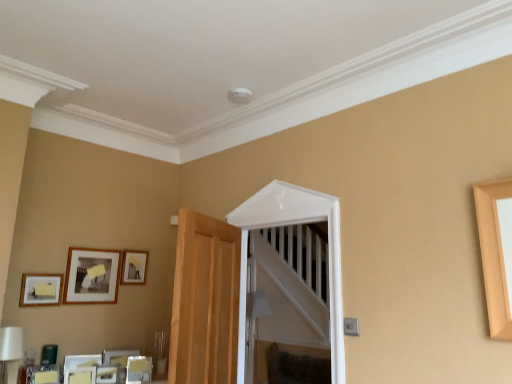
Question: Should I look upward or downward to see matte black picture frame at upper left, the 2th picture frame viewed from the top?

Choices:
 (A) up
 (B) down

Answer: (B)

Question: Does matte black picture frame at upper left, the 3th picture frame ordered from the bottom, turn towards white glossy door at center?

Choices:
 (A) yes
 (B) no

Answer: (A)

Question: Is the depth of matte black picture frame at upper left, the 2th picture frame viewed from the top, less than that of white glossy door at center?

Choices:
 (A) no
 (B) yes

Answer: (A)

Question: Considering the relative sizes of matte black picture frame at upper left, the 3th picture frame ordered from the bottom, and white glossy door at center in the image provided, is matte black picture frame at upper left, the 3th picture frame ordered from the bottom, wider than white glossy door at center?

Choices:
 (A) yes
 (B) no

Answer: (B)

Question: From the image's perspective, is matte black picture frame at upper left, the 3th picture frame ordered from the bottom, over white glossy door at center?

Choices:
 (A) no
 (B) yes

Answer: (A)

Question: Does matte black picture frame at upper left, the 2th picture frame viewed from the top, come behind white glossy door at center?

Choices:
 (A) yes
 (B) no

Answer: (A)

Question: Is matte black picture frame at upper left, the 2th picture frame viewed from the top, oriented away from white glossy door at center?

Choices:
 (A) no
 (B) yes

Answer: (A)

Question: From a real-world perspective, is white glossy door at center physically below matte black picture frame at upper left, the 3th picture frame ordered from the bottom?

Choices:
 (A) yes
 (B) no

Answer: (A)

Question: Considering the relative sizes of white glossy door at center and matte black picture frame at upper left, the 2th picture frame viewed from the top, in the image provided, is white glossy door at center wider than matte black picture frame at upper left, the 2th picture frame viewed from the top,?

Choices:
 (A) yes
 (B) no

Answer: (A)

Question: Would you say white glossy door at center is outside matte black picture frame at upper left, the 2th picture frame viewed from the top?

Choices:
 (A) yes
 (B) no

Answer: (A)

Question: Is white glossy door at center in front of matte black picture frame at upper left, the 2th picture frame viewed from the top?

Choices:
 (A) no
 (B) yes

Answer: (B)

Question: From the image's perspective, is white glossy door at center over matte black picture frame at upper left, the 3th picture frame ordered from the bottom?

Choices:
 (A) no
 (B) yes

Answer: (B)

Question: Is matte black picture frame at upper left, the 2th picture frame viewed from the top, a part of white glossy door at center?

Choices:
 (A) yes
 (B) no

Answer: (B)

Question: From the image's perspective, is wooden picture frame at upper left, marked as the 4th picture frame in a bottom-to-top arrangement, under matte black picture frame at upper left, the 3th picture frame ordered from the bottom?

Choices:
 (A) yes
 (B) no

Answer: (B)